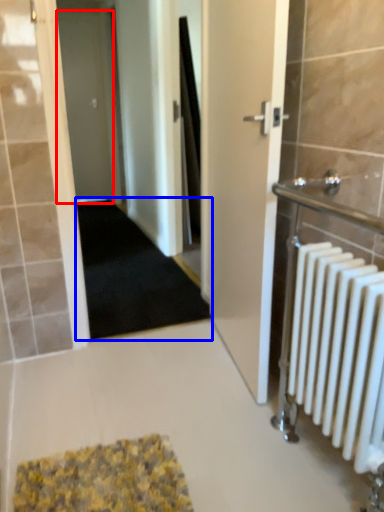
Question: Among these objects, which one is farthest to the camera, door (highlighted by a red box) or doormat (highlighted by a blue box)?

Choices:
 (A) door
 (B) doormat

Answer: (A)